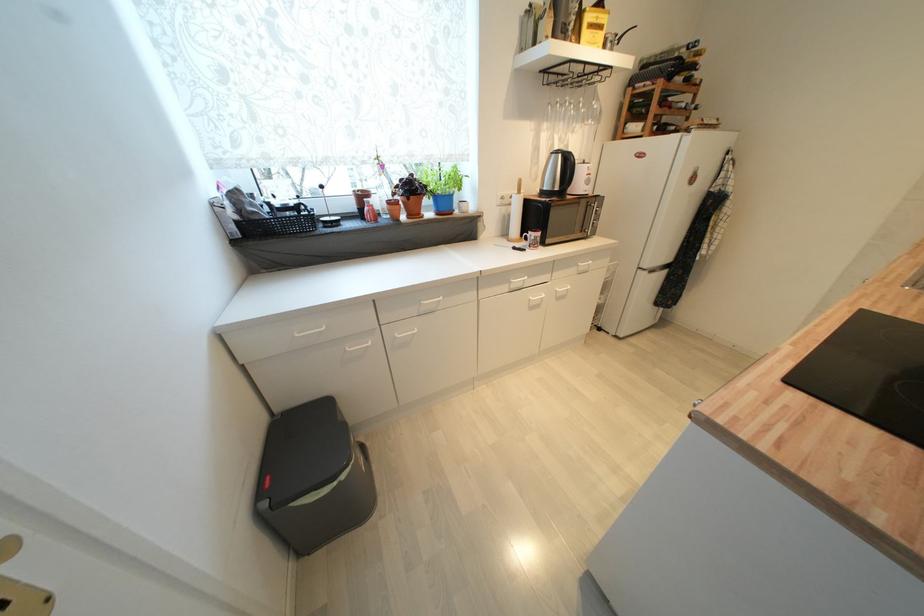
Where would you lift the mug handle? Please return your answer as a coordinate pair (x, y).

(532, 240)